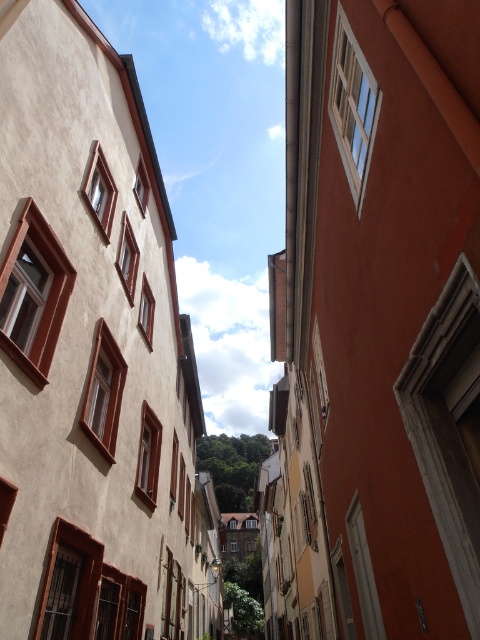
You are standing on the street and want to take a photo of both the smooth orange wall at right and the smooth beige building at left. Which object should you point your camera towards first to ensure both are in the frame?

You should point your camera towards the smooth beige building at left first because the smooth orange wall at right is below it, so adjusting the angle upwards will include both in the frame.

Looking at this image, you are standing on the narrow street looking up towards the sky. There is a point at coordinates (376, 326). What is located at this point?

The smooth orange wall at right is located at point (376, 326).